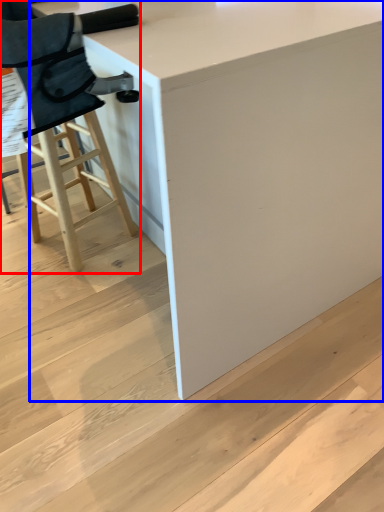
Question: Which of the following is the closest to the observer, chair (highlighted by a red box) or table (highlighted by a blue box)?

Choices:
 (A) chair
 (B) table

Answer: (B)